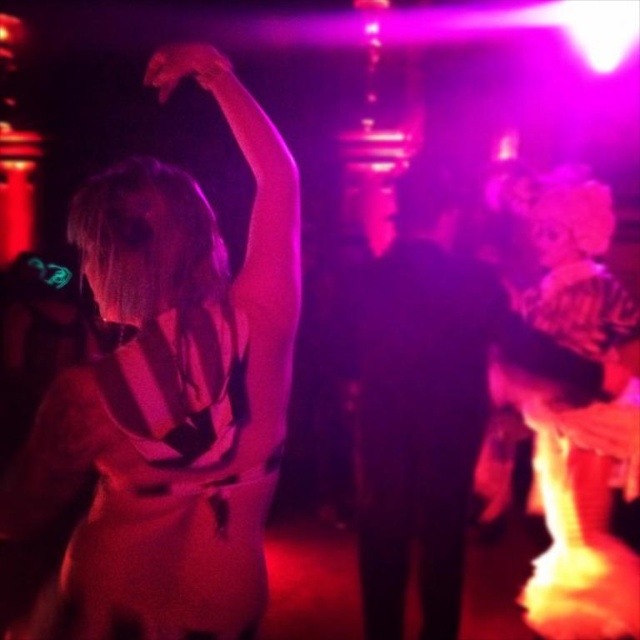
Question: Does matte white dress at upper left have a greater width compared to matte black hand at upper left?

Choices:
 (A) no
 (B) yes

Answer: (B)

Question: Does matte white dress at upper left appear under matte black hand at upper left?

Choices:
 (A) no
 (B) yes

Answer: (B)

Question: Can you confirm if matte white dress at upper left is positioned above matte black hand at upper left?

Choices:
 (A) no
 (B) yes

Answer: (A)

Question: Among these objects, which one is nearest to the camera?

Choices:
 (A) matte black hand at upper left
 (B) matte white dress at upper left

Answer: (B)

Question: Which of the following is the closest to the observer?

Choices:
 (A) (172, 45)
 (B) (278, 154)

Answer: (A)